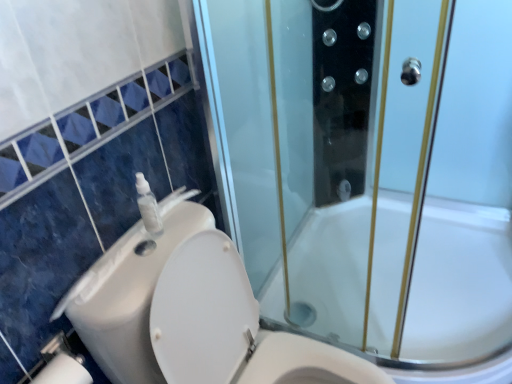
Question: From the image's perspective, is white plastic sink at left under transparent glass shower door at center?

Choices:
 (A) no
 (B) yes

Answer: (B)

Question: Is white plastic sink at left positioned with its back to transparent glass shower door at center?

Choices:
 (A) no
 (B) yes

Answer: (A)

Question: Is white plastic sink at left closer to camera compared to transparent glass shower door at center?

Choices:
 (A) yes
 (B) no

Answer: (B)

Question: Considering the relative sizes of white plastic sink at left and transparent glass shower door at center in the image provided, is white plastic sink at left smaller than transparent glass shower door at center?

Choices:
 (A) yes
 (B) no

Answer: (A)

Question: From a real-world perspective, is white plastic sink at left physically below transparent glass shower door at center?

Choices:
 (A) yes
 (B) no

Answer: (B)

Question: Is white plastic sink at left to the right of transparent glass shower door at center from the viewer's perspective?

Choices:
 (A) yes
 (B) no

Answer: (B)

Question: Would you say white plastic toilet at lower left is a long distance from transparent plastic soap dispenser at upper left?

Choices:
 (A) yes
 (B) no

Answer: (B)

Question: Considering the relative sizes of white plastic toilet at lower left and transparent plastic soap dispenser at upper left in the image provided, is white plastic toilet at lower left bigger than transparent plastic soap dispenser at upper left?

Choices:
 (A) no
 (B) yes

Answer: (B)

Question: Can you confirm if white plastic toilet at lower left is positioned to the right of transparent plastic soap dispenser at upper left?

Choices:
 (A) yes
 (B) no

Answer: (A)

Question: Is white plastic toilet at lower left positioned behind transparent plastic soap dispenser at upper left?

Choices:
 (A) no
 (B) yes

Answer: (A)

Question: Is white plastic toilet at lower left turned away from transparent plastic soap dispenser at upper left?

Choices:
 (A) yes
 (B) no

Answer: (B)

Question: Is white plastic toilet at lower left smaller than transparent plastic soap dispenser at upper left?

Choices:
 (A) no
 (B) yes

Answer: (A)

Question: Is transparent glass shower door at center in front of transparent plastic soap dispenser at upper left?

Choices:
 (A) no
 (B) yes

Answer: (B)